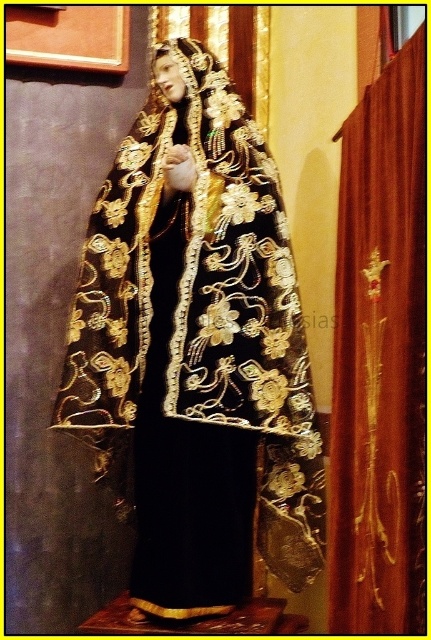
You are standing in front of the statue and want to place a small bouquet of flowers between the black velvet cape at center and the burgundy velvet curtain at right. Which object should you place the bouquet closer to if you want it to be nearer to the cape?

You should place the bouquet closer to the black velvet cape at center because it is located to the left of the burgundy velvet curtain at right.

You are an art conservator examining the statue. You notice the black velvet cape at center and the burgundy velvet curtain at right. Which object is layered on top of the other?

The black velvet cape at center is positioned over the burgundy velvet curtain at right, so the black velvet cape at center is layered on top.

You are an interior designer assessing the space around the statue. The black velvet cape at center and the burgundy velvet curtain at right are both part of the decor. If you want to place a decorative pillow between them, which object should the pillow be closer to to ensure it fits within the available space?

The black velvet cape at center might be wider than burgundy velvet curtain at right, so the pillow should be placed closer to the burgundy velvet curtain at right to ensure it fits within the available space.